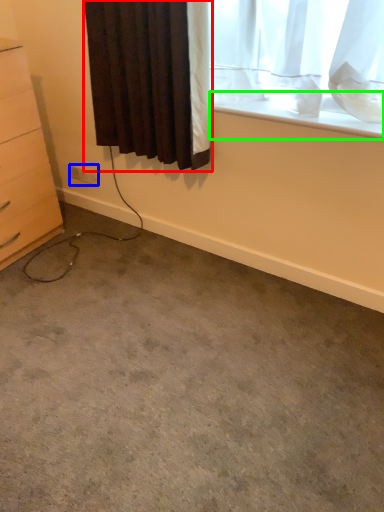
Question: Considering the real-world distances, which object is closest to curtain (highlighted by a red box)? electric outlet (highlighted by a blue box) or window sill (highlighted by a green box).

Choices:
 (A) electric outlet
 (B) window sill

Answer: (B)